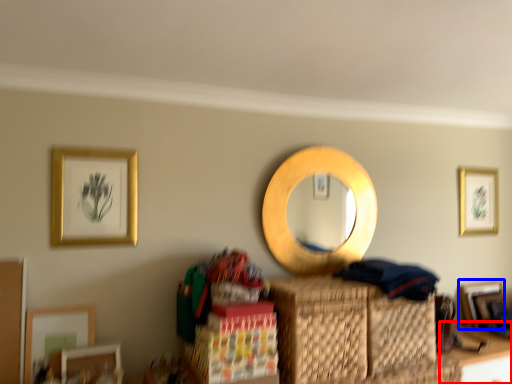
Question: Which of the following is the closest to the observer, table (highlighted by a red box) or picture frame (highlighted by a blue box)?

Choices:
 (A) table
 (B) picture frame

Answer: (A)